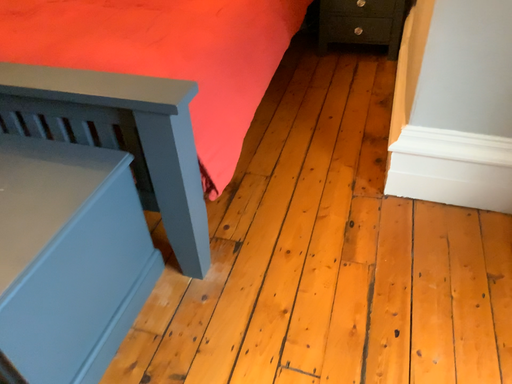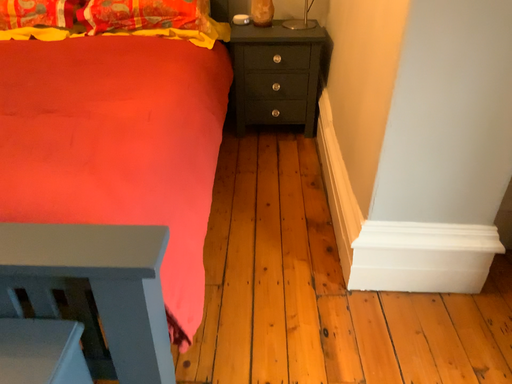
Question: How did the camera likely rotate when shooting the video?

Choices:
 (A) rotated left
 (B) rotated right

Answer: (B)